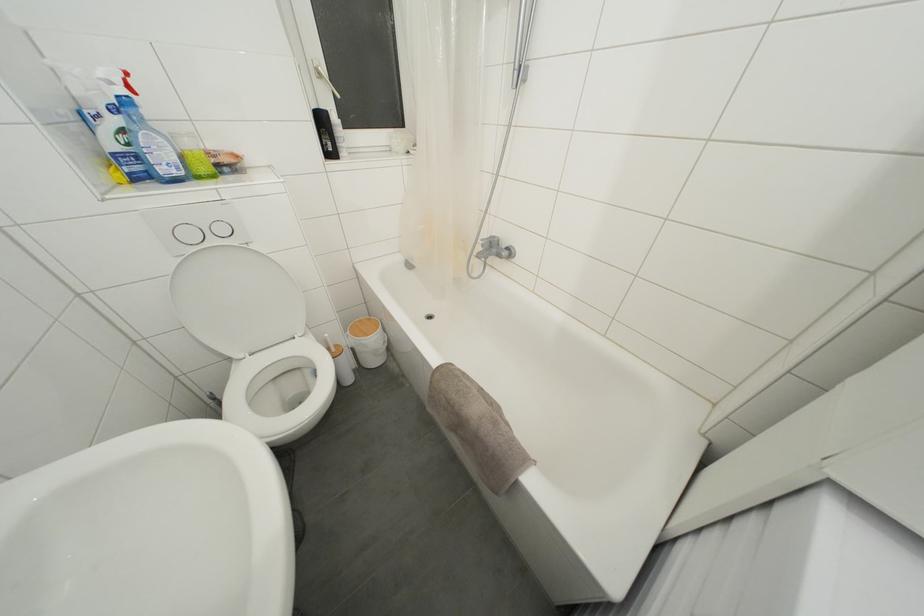
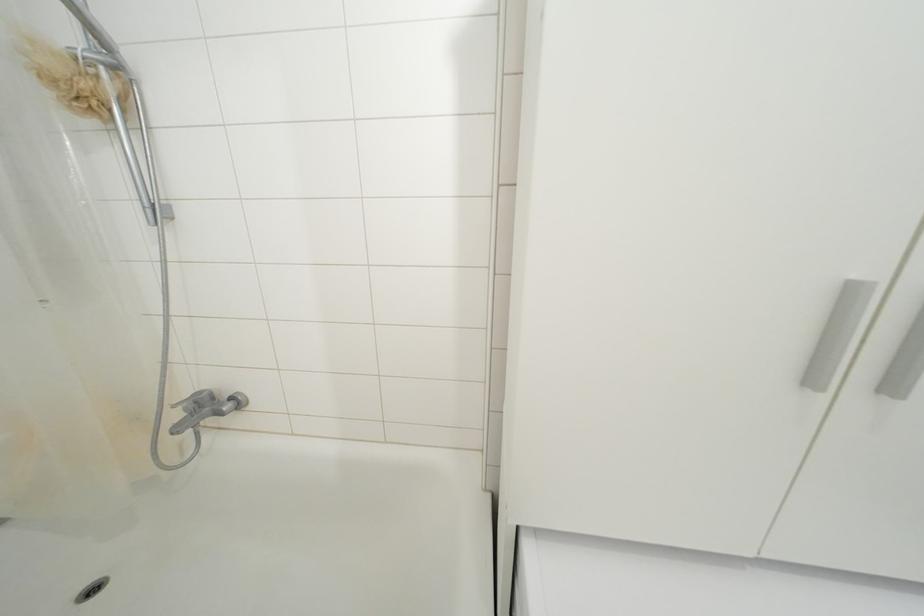
Question: The camera is either moving clockwise (left) or counter-clockwise (right) around the object. The first image is from the beginning of the video and the second image is from the end. Is the camera moving left or right when shooting the video?

Choices:
 (A) Left
 (B) Right

Answer: (A)